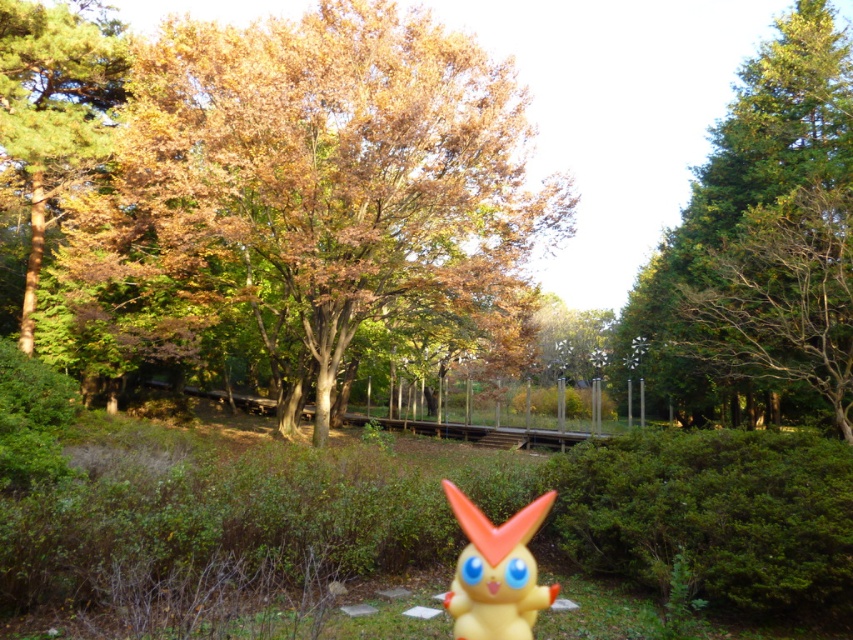
Question: Among these objects, which one is nearest to the camera?

Choices:
 (A) brown wooden train track at center
 (B) green leafy hedge at center
 (C) brown/dry wood at upper right
 (D) yellow matte plush at center

Answer: (D)

Question: Among these points, which one is farthest from the camera?

Choices:
 (A) (521, 627)
 (B) (791, 374)
 (C) (405, 268)
 (D) (670, 481)

Answer: (B)

Question: Is green textured tree at right wider than brown wooden train track at center?

Choices:
 (A) no
 (B) yes

Answer: (A)

Question: Can you confirm if green leafy hedge at center is positioned above yellow matte plush at center?

Choices:
 (A) no
 (B) yes

Answer: (A)

Question: Can you confirm if green leafy hedge at center is positioned above yellow matte plush at center?

Choices:
 (A) no
 (B) yes

Answer: (A)

Question: Which point is farther to the camera?

Choices:
 (A) (606, 532)
 (B) (779, 316)

Answer: (B)